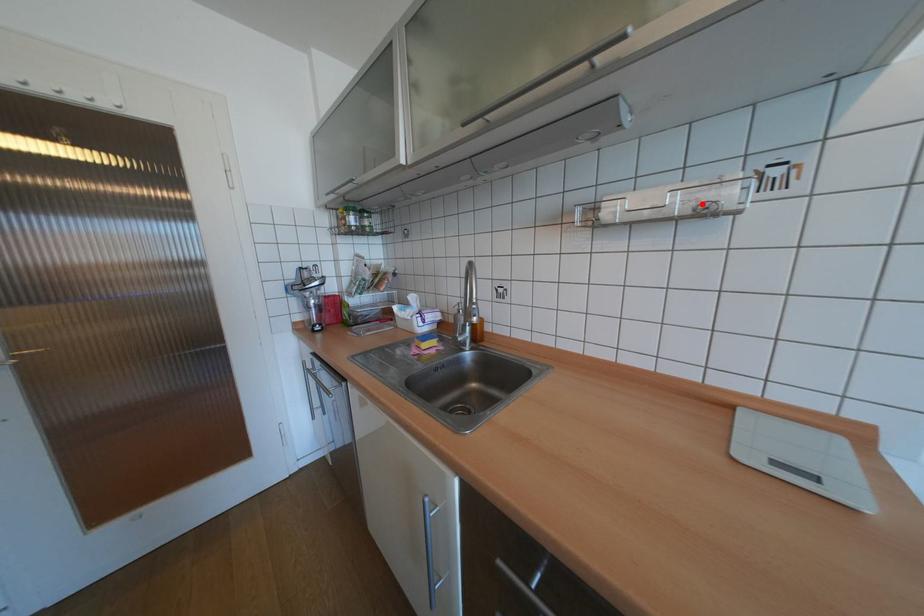
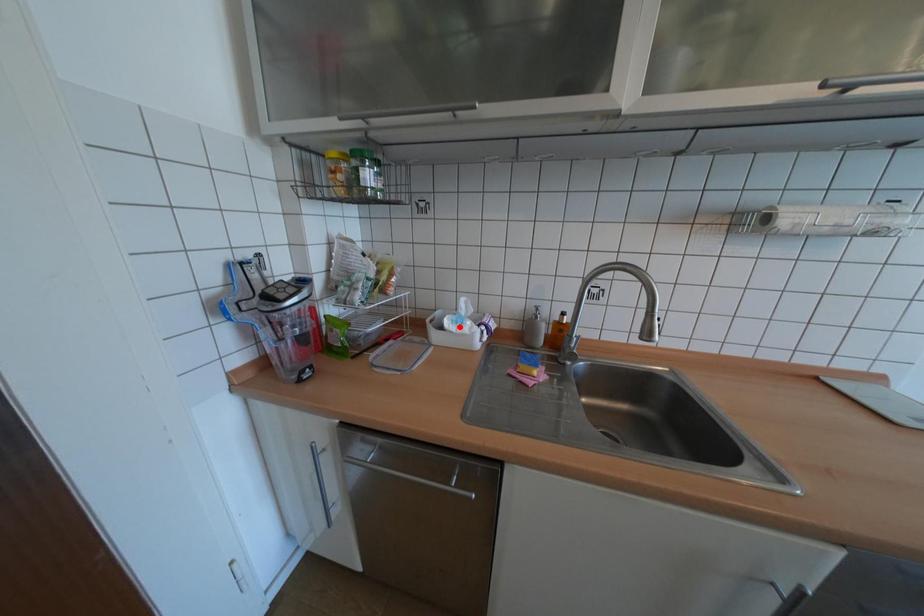
I am providing you with two images of the same scene from different viewpoints. A red point is marked on the first image and another point is marked on the second image. Does the point marked in image1 correspond to the same location as the one in image2?

No